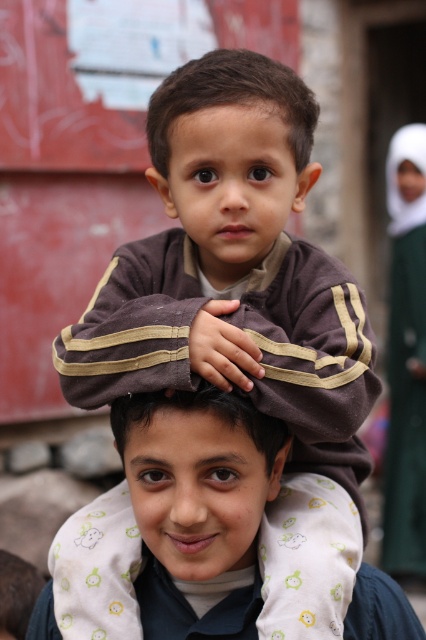
Question: Where is smooth brown hair at center located in relation to green fabric at upper right in the image?

Choices:
 (A) below
 (B) above

Answer: (A)

Question: Which object appears farthest from the camera in this image?

Choices:
 (A) smooth brown hair at center
 (B) brown matte head at center

Answer: (B)

Question: Is brown matte head at center bigger than smooth brown hair at center?

Choices:
 (A) no
 (B) yes

Answer: (B)

Question: Considering the relative positions of brown matte head at center and green fabric at upper right in the image provided, where is brown matte head at center located with respect to green fabric at upper right?

Choices:
 (A) left
 (B) right

Answer: (A)

Question: Which of the following is the closest to the observer?

Choices:
 (A) (284, 403)
 (B) (172, 416)
 (C) (201, 83)
 (D) (408, 497)

Answer: (B)

Question: Which of the following is the farthest from the observer?

Choices:
 (A) smooth brown hair at center
 (B) brown soft fabric at center
 (C) brown matte head at center

Answer: (C)